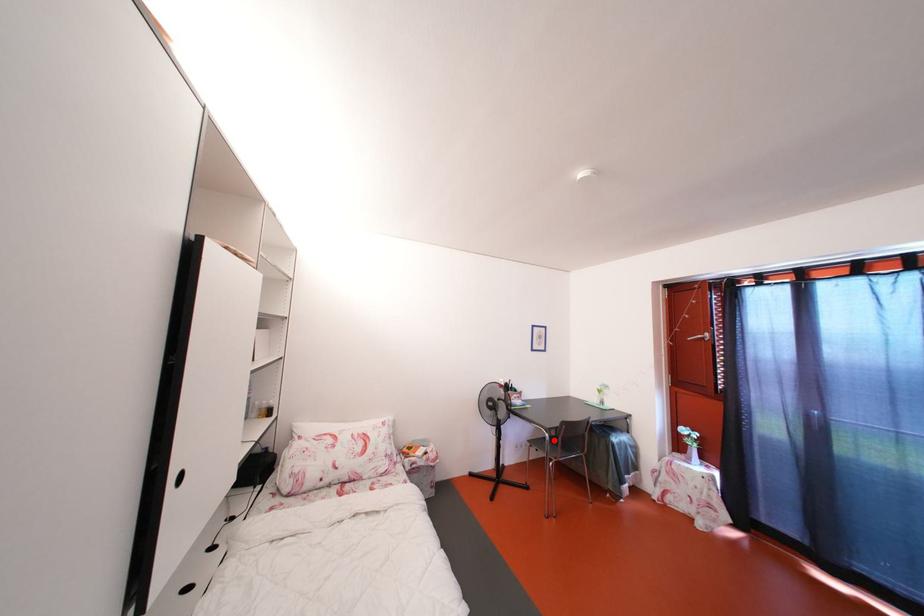
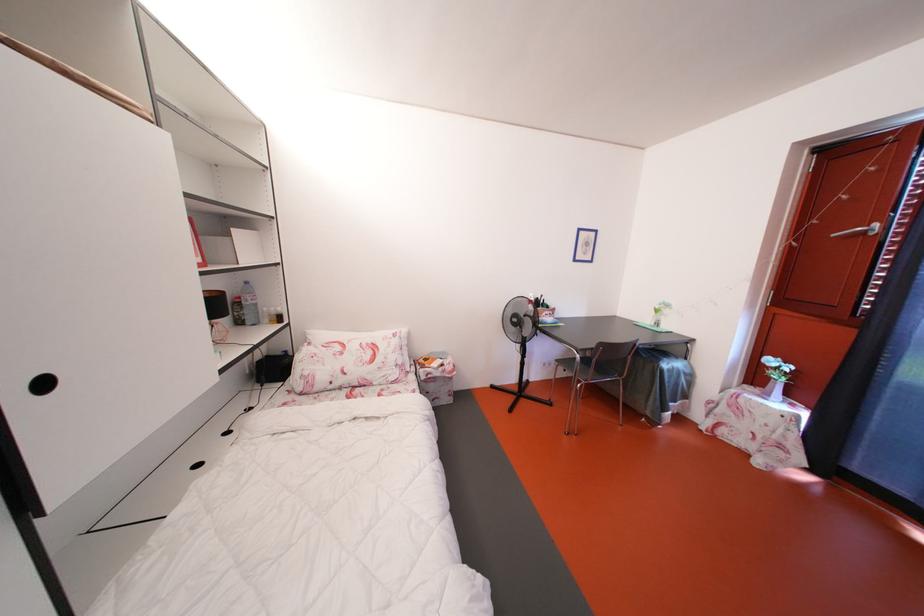
Find the pixel in the second image that matches the highlighted location in the first image.

(585, 362)